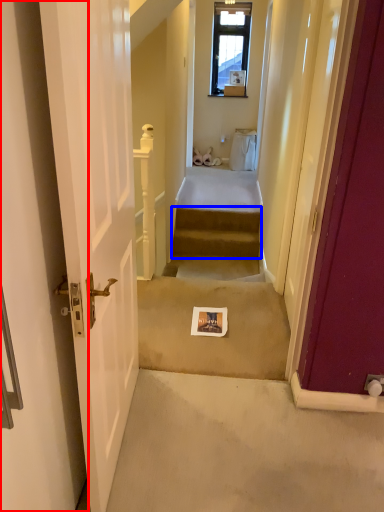
Question: Among these objects, which one is farthest to the camera, door (highlighted by a red box) or stairs (highlighted by a blue box)?

Choices:
 (A) door
 (B) stairs

Answer: (B)